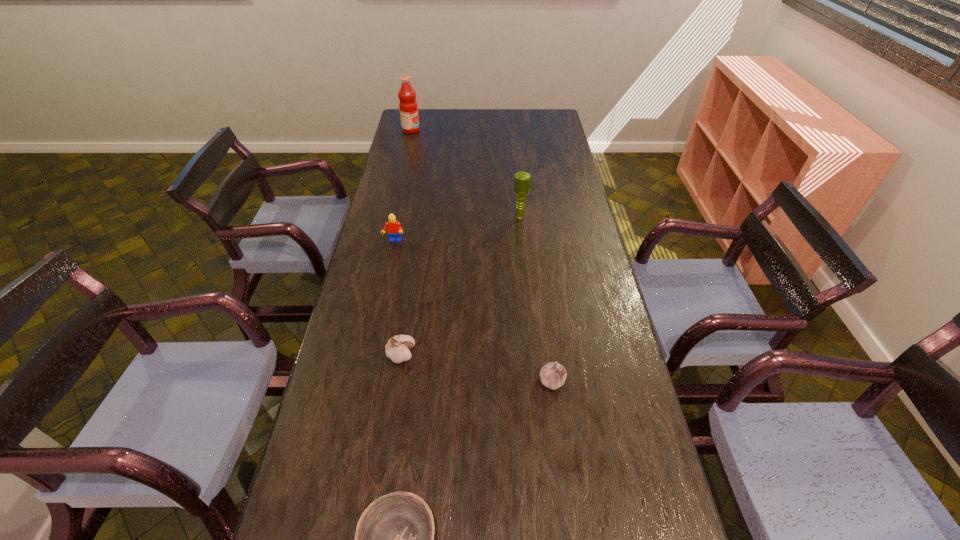
In order to click on blank space at the left edge of the desktop in this screenshot , I will do `click(373, 279)`.

You are a GUI agent. You are given a task and a screenshot of the screen. Output one action in this format:
    pyautogui.click(x=<x>, y=<y>)
    Task: Click on the vacant space at the right edge of the desktop
    
    Given the screenshot: What is the action you would take?
    pyautogui.click(x=551, y=212)

I want to click on vacant space that's between the farther garlic and the microphone, so click(x=460, y=286).

Identify the location of vacant area that lies between the tallest object and the fourth farthest object. (406, 242).

Identify the location of free spot between the tallest object and the fifth farthest object. This screenshot has height=540, width=960. (482, 255).

Identify the location of free space between the fruit juice and the fourth farthest object. (406, 242).

Locate an element on the screen. Image resolution: width=960 pixels, height=540 pixels. free space between the right garlic and the fourth farthest object is located at coordinates (476, 368).

The height and width of the screenshot is (540, 960). I want to click on vacant area that lies between the second nearest object and the farther garlic, so click(476, 368).

What are the coordinates of `free point between the third farthest object and the farthest object` in the screenshot? It's located at (402, 186).

Locate an element on the screen. free point between the fruit juice and the fourth nearest object is located at coordinates (402, 186).